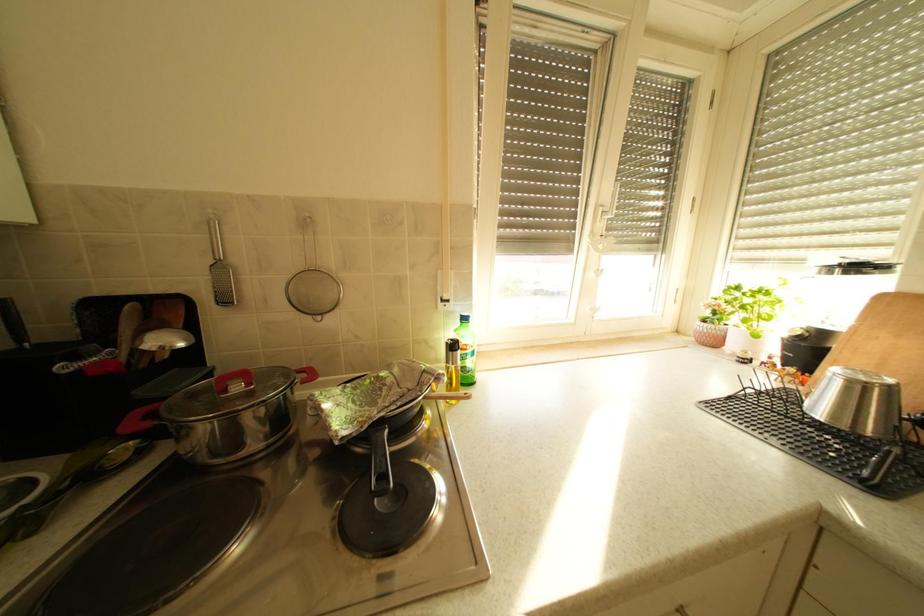
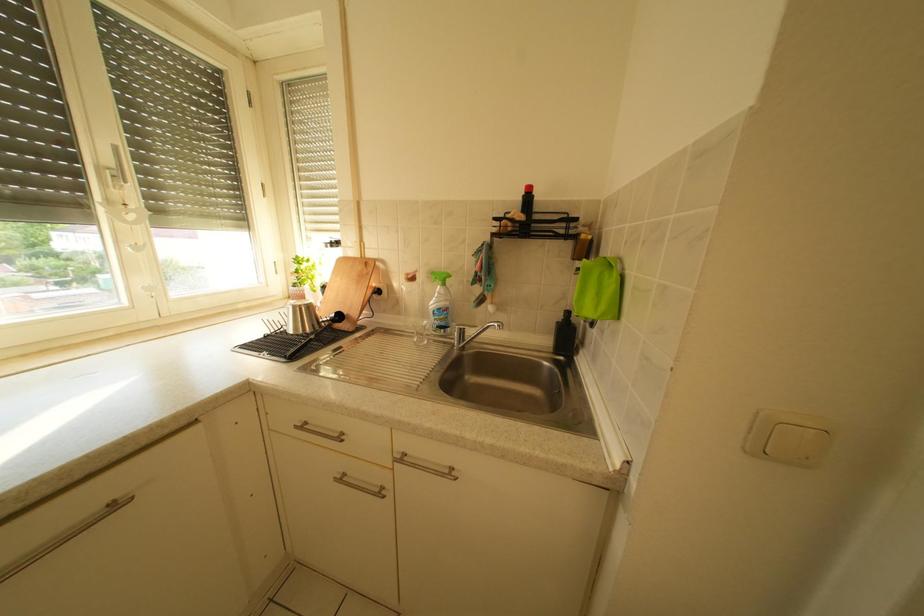
Question: The camera is either moving clockwise (left) or counter-clockwise (right) around the object. The first image is from the beginning of the video and the second image is from the end. Is the camera moving left or right when shooting the video?

Choices:
 (A) Left
 (B) Right

Answer: (A)